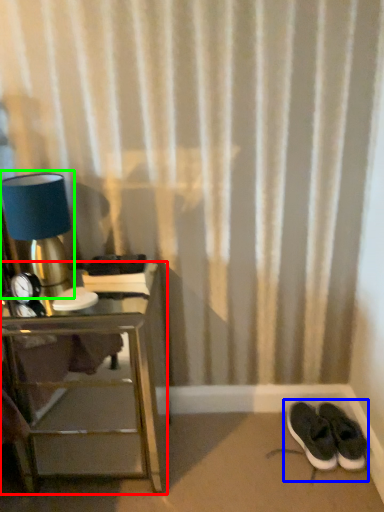
Question: Which object is positioned closest to nightstand (highlighted by a red box)? Select from footwear (highlighted by a blue box) and table lamp (highlighted by a green box).

Choices:
 (A) footwear
 (B) table lamp

Answer: (B)